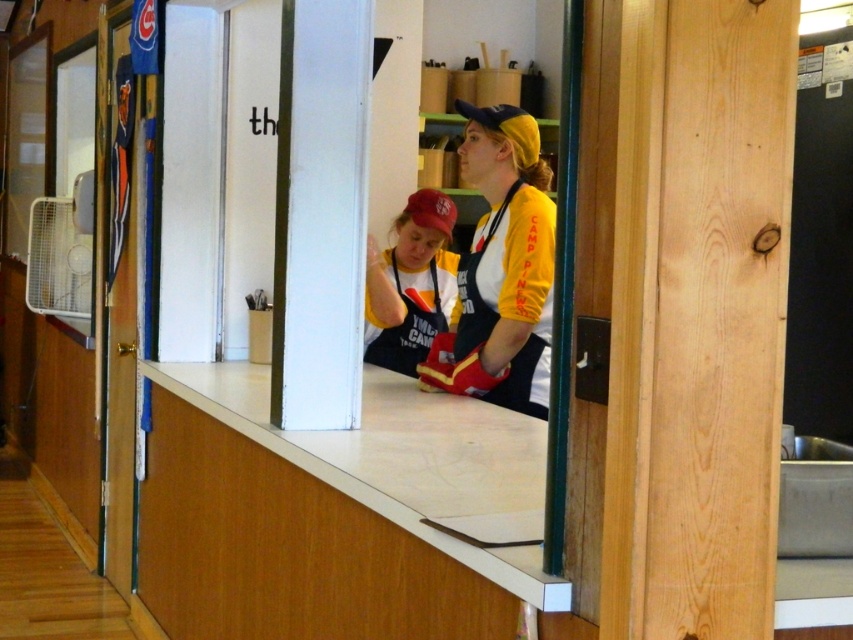
Is yellow matte baseball cap at upper center smaller than matte red baseball cap at center?

No.

Does yellow matte baseball cap at upper center have a lesser height compared to matte red baseball cap at center?

In fact, yellow matte baseball cap at upper center may be taller than matte red baseball cap at center.

Does point (527, 122) come farther from viewer compared to point (442, 211)?

That is False.

Locate an element on the screen. yellow matte baseball cap at upper center is located at coordinates (508, 128).

Based on the photo, does matte red cap at center appear over matte red baseball cap at center?

No, matte red cap at center is not above matte red baseball cap at center.

In the scene shown: Does matte red cap at center have a greater height compared to matte red baseball cap at center?

Indeed, matte red cap at center has a greater height compared to matte red baseball cap at center.

Is point (395, 301) less distant than point (445, 198)?

Yes.

At what (x,y) coordinates should I click in order to perform the action: click on matte red cap at center. Please return your answer as a coordinate pair (x, y). The image size is (853, 640). Looking at the image, I should click on (410, 284).

Is point (509, 390) farther from viewer compared to point (401, 262)?

No, (509, 390) is in front of (401, 262).

How far apart are yellow matte apron at center and matte red cap at center?

The distance of yellow matte apron at center from matte red cap at center is 29.47 inches.

Is point (492, 172) in front of point (364, 321)?

Yes, it is.

The width and height of the screenshot is (853, 640). In order to click on yellow matte apron at center in this screenshot , I will do `click(503, 268)`.